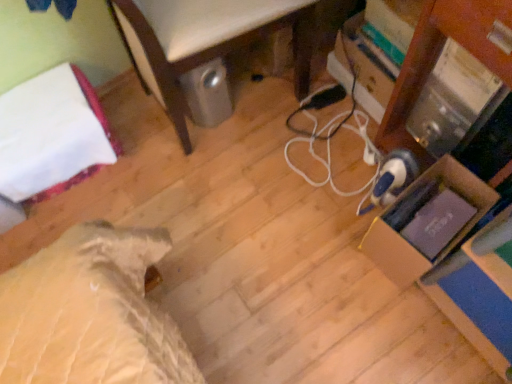
Find the location of `free space in front of metallic silver trash can at lower center`. free space in front of metallic silver trash can at lower center is located at coordinates (241, 220).